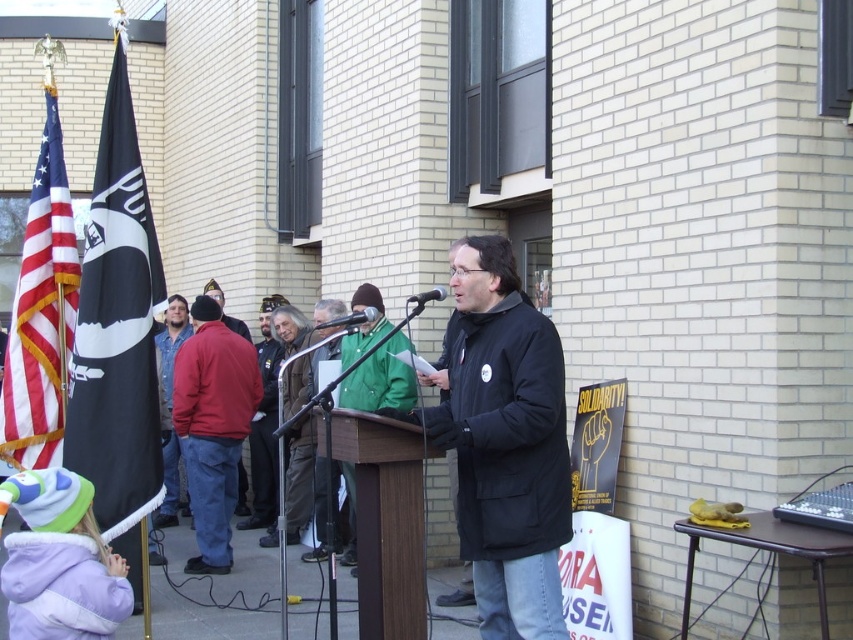
Is green fabric jacket at center positioned in front of black metallic microphone at center?

No, green fabric jacket at center is further to the viewer.

Measure the distance between green fabric jacket at center and black metallic microphone at center.

They are 5.06 meters apart.

What do you see at coordinates (265, 424) in the screenshot? I see `green fabric jacket at center` at bounding box center [265, 424].

Identify the location of green fabric jacket at center. (265, 424).

Between point (16, 611) and point (271, 356), which one is positioned in front?

Point (16, 611) is more forward.

Can you confirm if purple fleece jacket at lower left is positioned to the right of green fabric jacket at center?

Indeed, purple fleece jacket at lower left is positioned on the right side of green fabric jacket at center.

Is point (13, 596) positioned after point (265, 364)?

No, (13, 596) is in front of (265, 364).

Where is `purple fleece jacket at lower left`? This screenshot has height=640, width=853. purple fleece jacket at lower left is located at coordinates (59, 561).

Who is higher up, black matte jacket at center or black metallic microphone at center?

Positioned higher is black metallic microphone at center.

Does black matte jacket at center have a lesser height compared to black metallic microphone at center?

Incorrect, black matte jacket at center's height does not fall short of black metallic microphone at center's.

Does point (461, 467) lie behind point (444, 296)?

Yes, point (461, 467) is behind point (444, 296).

Locate an element on the screen. The width and height of the screenshot is (853, 640). black matte jacket at center is located at coordinates (506, 444).